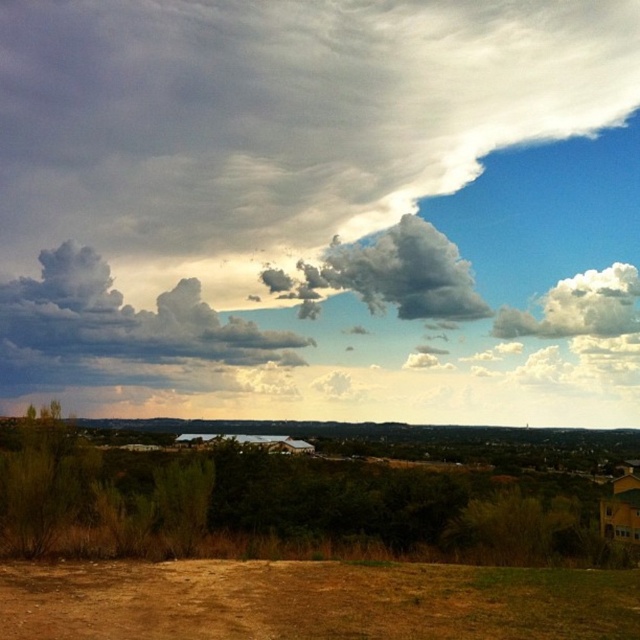
You are standing at the origin point in the image. Which direction should you move to reach the brown dirt field at lower center?

The brown dirt field at lower center is located at coordinates approximately 0.941 on the x axis and 0.489 on the y axis. Since you are at the origin point, you should move towards the right and slightly upwards to reach the brown dirt field at lower center.

You are standing at the viewpoint in the image and see two points marked. Which point, point (x=304, y=564) or point (x=291, y=444), is closer to you?

Point (x=304, y=564) is closer to you because it is in front of point (x=291, y=444).

You are an airplane passenger looking out the window and see the brown dirt field at lower center and the white fluffy cloud at upper right. Which object is closer to the ground?

The brown dirt field at lower center is closer to the ground because it is positioned under the white fluffy cloud at upper right.